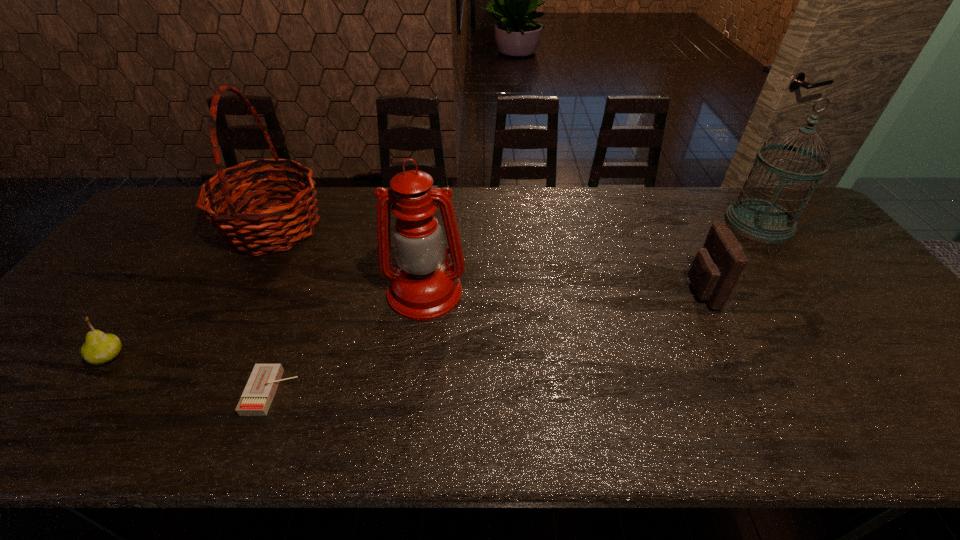
The height and width of the screenshot is (540, 960). I want to click on basket, so click(x=243, y=232).

At what (x,y) coordinates should I click in order to perform the action: click on the rightmost object. Please return your answer as a coordinate pair (x, y). This screenshot has height=540, width=960. Looking at the image, I should click on (759, 220).

At what (x,y) coordinates should I click in order to perform the action: click on oil lamp. Please return your answer as a coordinate pair (x, y). The image size is (960, 540). Looking at the image, I should click on (424, 288).

I want to click on pouch, so click(714, 272).

Locate an element on the screen. the fourth tallest object is located at coordinates (714, 272).

At what (x,y) coordinates should I click in order to perform the action: click on the second shortest object. Please return your answer as a coordinate pair (x, y). This screenshot has width=960, height=540. Looking at the image, I should click on (99, 348).

Image resolution: width=960 pixels, height=540 pixels. Identify the location of the leftmost object. (99, 348).

Locate an element on the screen. This screenshot has height=540, width=960. matchbox is located at coordinates (260, 389).

Locate an element on the screen. free spot located 0.360m on the front of the basket is located at coordinates (197, 369).

Identify the location of free space located 0.380m on the front-facing side of the birdcage. (850, 347).